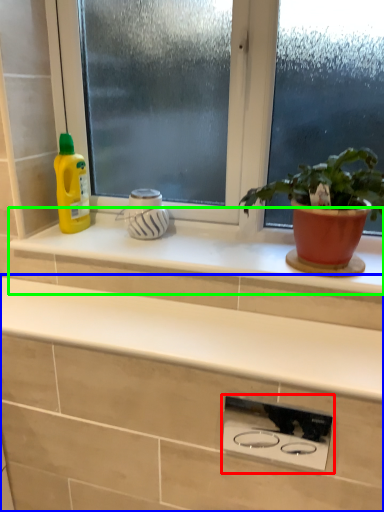
Question: Which is farther away from appliance (highlighted by a red box)? countertop (highlighted by a blue box) or window sill (highlighted by a green box)?

Choices:
 (A) countertop
 (B) window sill

Answer: (B)